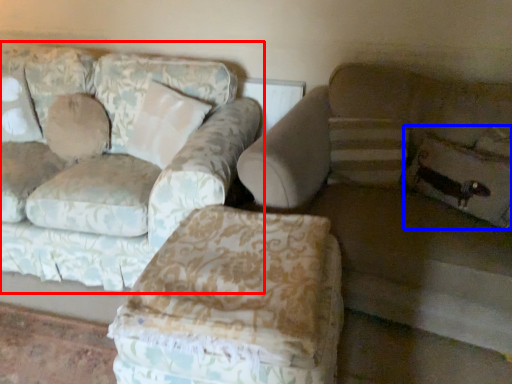
Question: Among these objects, which one is farthest to the camera, studio couch (highlighted by a red box) or pillow (highlighted by a blue box)?

Choices:
 (A) studio couch
 (B) pillow

Answer: (B)